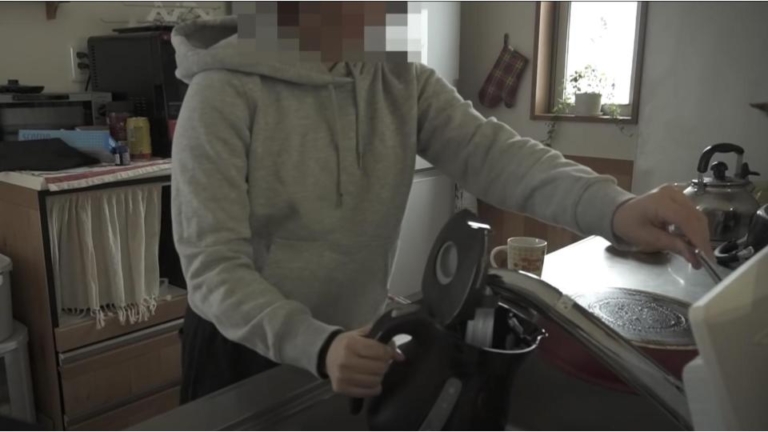
Identify the location of teapot. This screenshot has height=432, width=768. (457, 358).